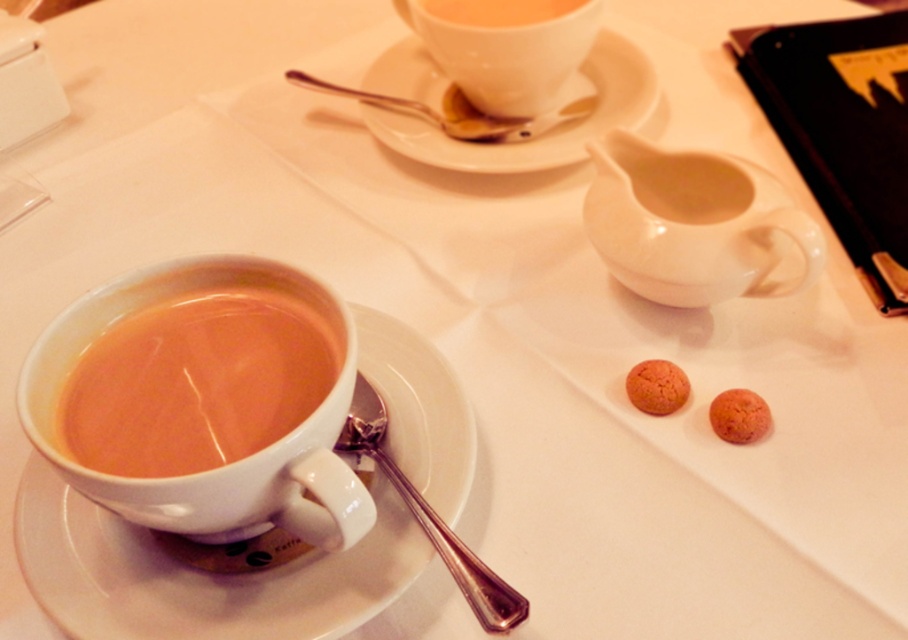
Question: Which is nearer to the matte white teacup at upper center?

Choices:
 (A) silver metallic spoon at lower center
 (B) silver metallic spoon at upper center

Answer: (B)

Question: Is white ceramic saucer at lower left thinner than silver metallic spoon at lower center?

Choices:
 (A) yes
 (B) no

Answer: (B)

Question: Is white ceramic saucer at upper center to the right of silver metallic spoon at lower center from the viewer's perspective?

Choices:
 (A) no
 (B) yes

Answer: (B)

Question: Which point appears farthest from the camera in this image?

Choices:
 (A) (583, 19)
 (B) (514, 604)
 (C) (585, 125)
 (D) (334, 360)

Answer: (C)

Question: Is matte white teacup at upper center positioned before matte ceramic cup at upper center?

Choices:
 (A) no
 (B) yes

Answer: (B)

Question: Which object is positioned farthest from the matte white cup of tea at lower left?

Choices:
 (A) white glossy creamer at upper right
 (B) matte ceramic cup at upper center

Answer: (B)